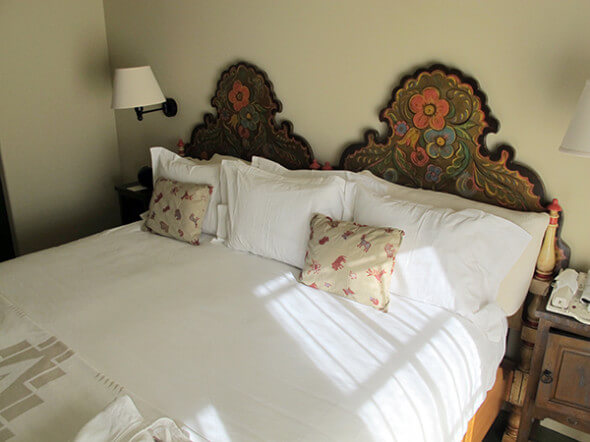
Locate an element on the screen. This screenshot has height=442, width=590. table top is located at coordinates (544, 314), (568, 322).